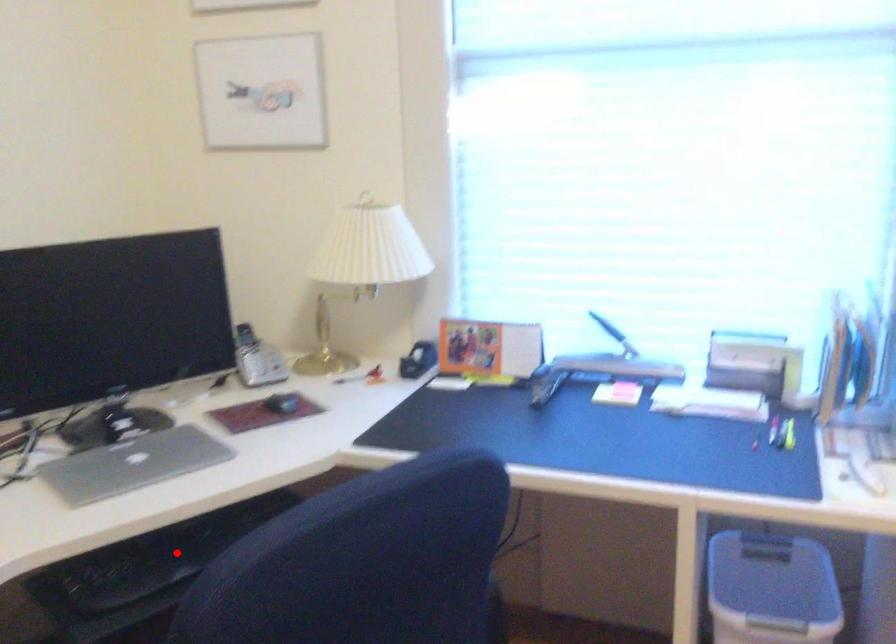
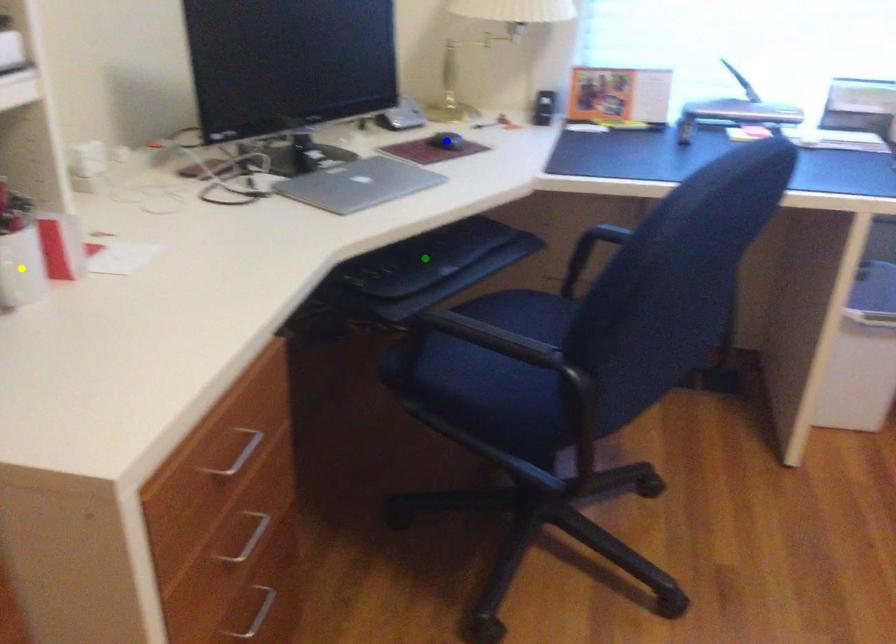
Question: I am providing you with two images of the same scene from different viewpoints. A red point is marked on the first image. You are given multiple points on the second image. In image 2, which mark is for the same physical point as the one in image 1?

Choices:
 (A) green point
 (B) blue point
 (C) yellow point

Answer: (A)